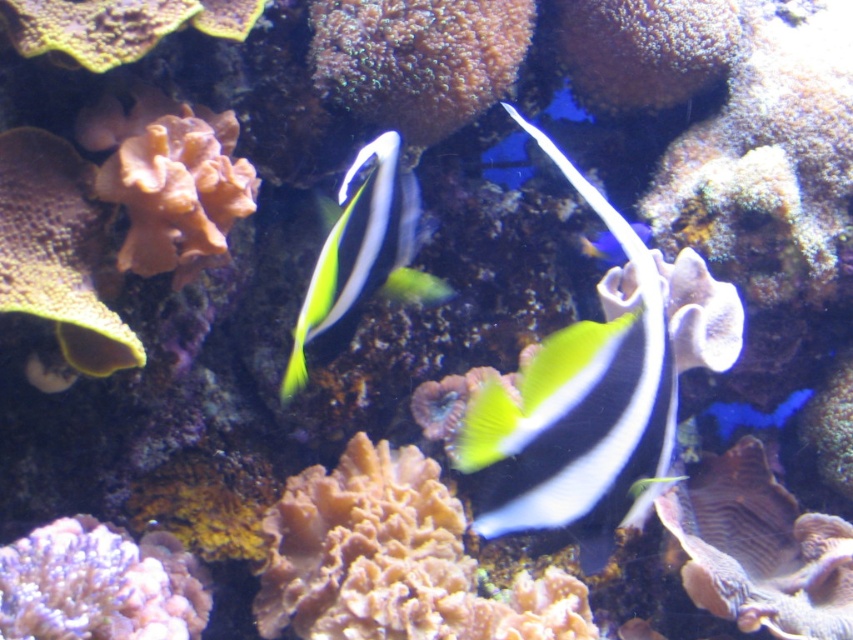
Question: Is black and white striped fish at center below orange coral at center?

Choices:
 (A) yes
 (B) no

Answer: (A)

Question: In this image, where is rusty brown coral at center located relative to black and white striped fish at center?

Choices:
 (A) left
 (B) right

Answer: (A)

Question: Which point appears farthest from the camera in this image?

Choices:
 (A) (1, 305)
 (B) (408, 257)

Answer: (B)

Question: Which of the following is the farthest from the observer?

Choices:
 (A) rusty brown coral at center
 (B) yellow-green glossy fish at center

Answer: (A)

Question: Does orange coral at center come in front of pink coral at lower left?

Choices:
 (A) no
 (B) yes

Answer: (A)

Question: Which object appears farthest from the camera in this image?

Choices:
 (A) pink coral at lower left
 (B) yellow-green glossy fish at center
 (C) orange coral at center
 (D) rusty brown coral at center

Answer: (D)